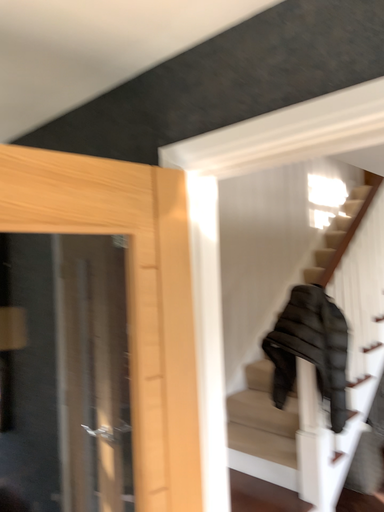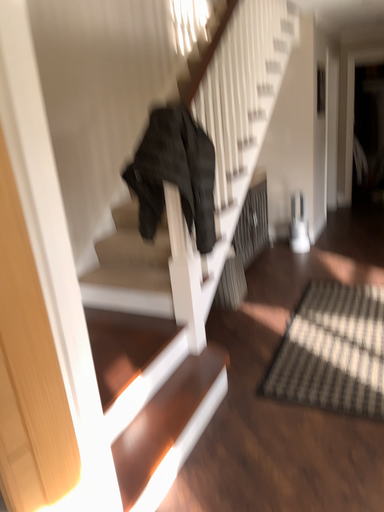
Question: How did the camera likely rotate when shooting the video?

Choices:
 (A) rotated right
 (B) rotated left

Answer: (A)